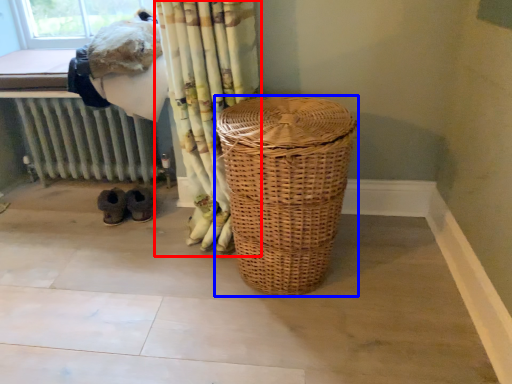
Question: Which of the following is the closest to the observer, curtain (highlighted by a red box) or laundry basket (highlighted by a blue box)?

Choices:
 (A) curtain
 (B) laundry basket

Answer: (B)